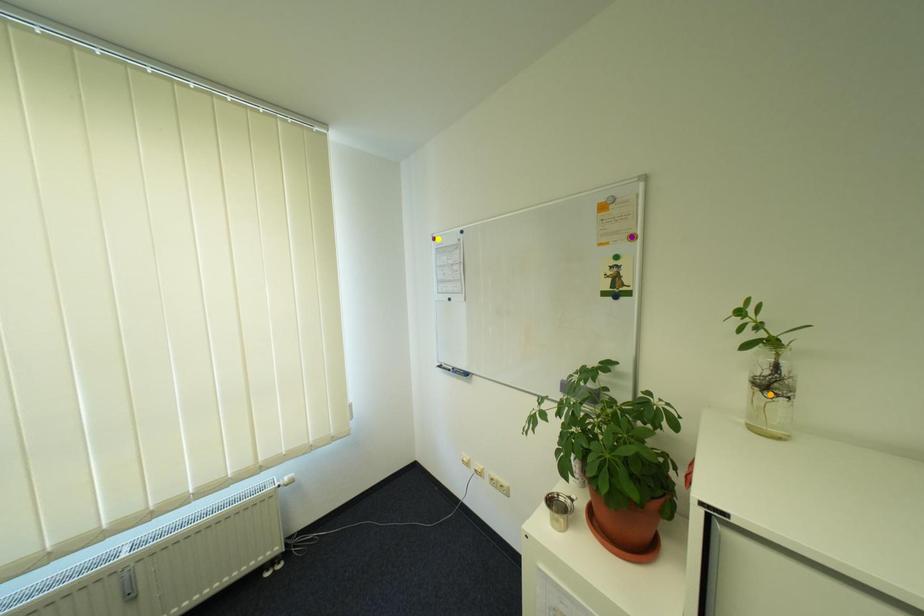
Order these from nearest to farthest:
yellow point, purple point, orange point

orange point → purple point → yellow point